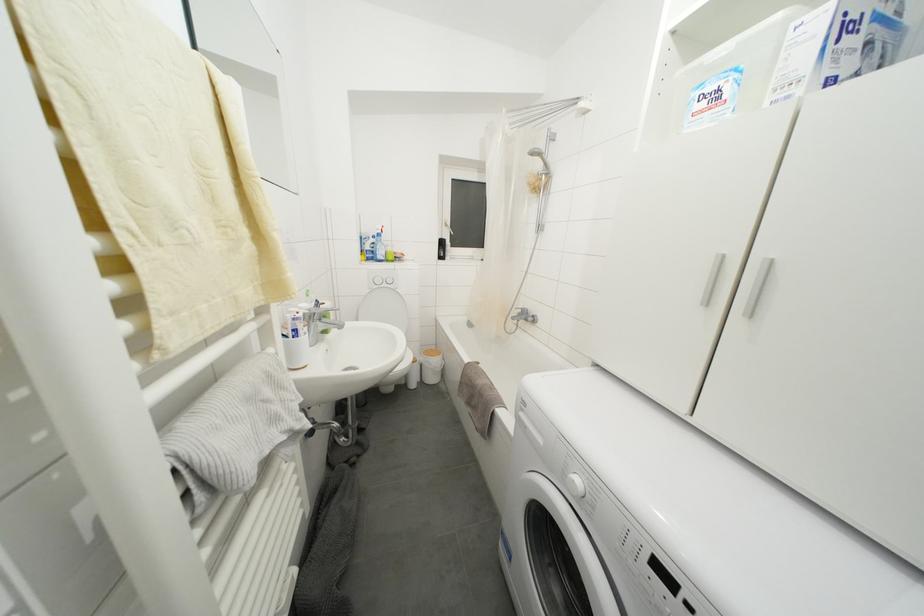
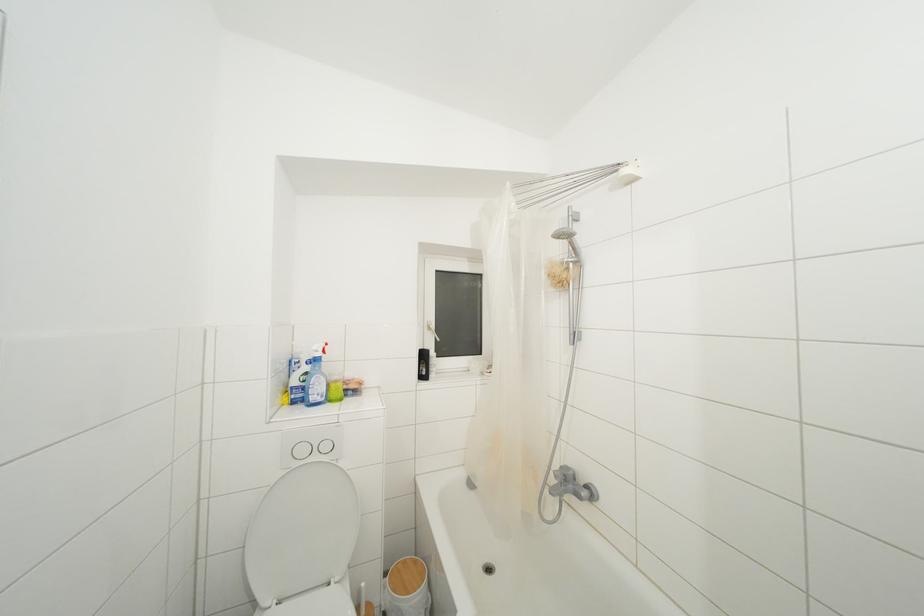
The point at (388, 290) is marked in the first image. Where is the corresponding point in the second image?

(320, 463)